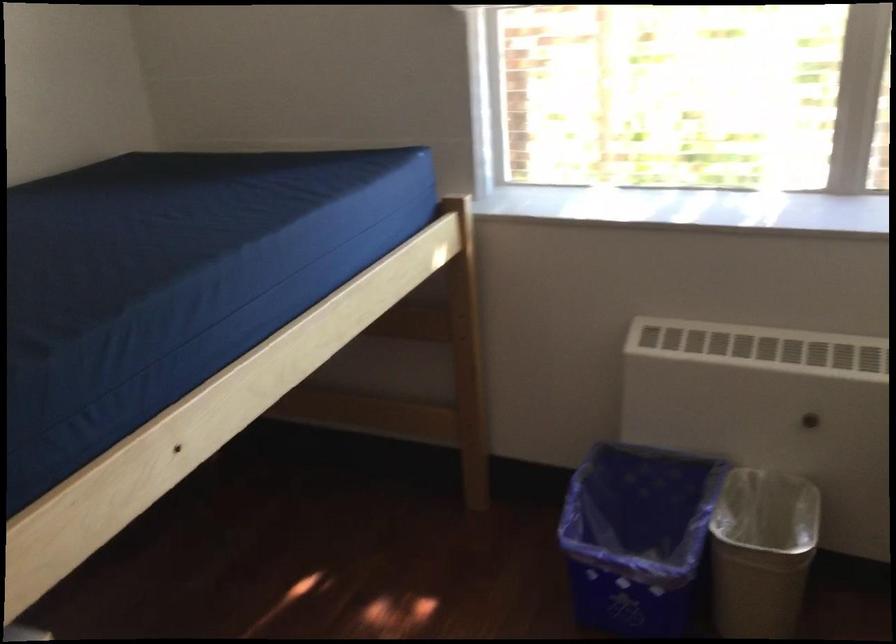
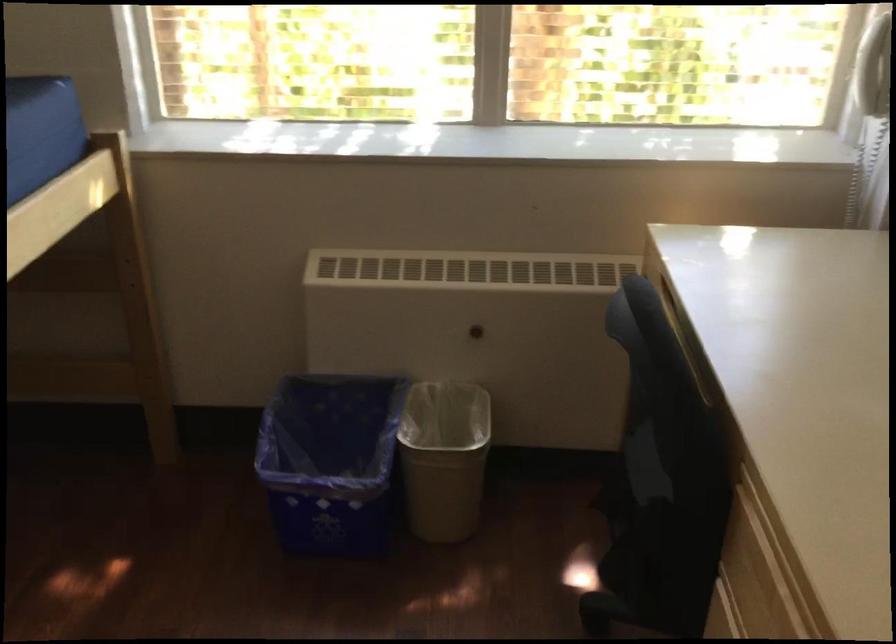
The images are taken continuously from a first-person perspective. In which direction are you moving?

The cameraman walked toward right, backward.